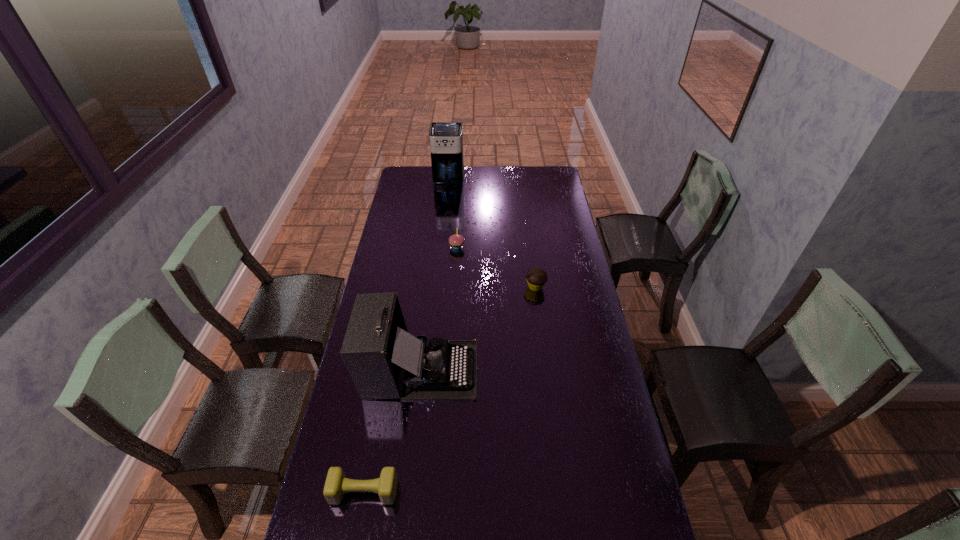
The width and height of the screenshot is (960, 540). Identify the location of coffee maker. (446, 138).

This screenshot has height=540, width=960. I want to click on typewriter, so click(x=384, y=361).

Where is `the fourth nearest object`? This screenshot has height=540, width=960. the fourth nearest object is located at coordinates (456, 240).

This screenshot has height=540, width=960. I want to click on cupcake, so click(x=456, y=240).

In order to click on muffin in this screenshot , I will do `click(536, 277)`.

I want to click on the third farthest object, so click(x=536, y=277).

Locate an element on the screen. Image resolution: width=960 pixels, height=540 pixels. dumbbell is located at coordinates (336, 485).

The image size is (960, 540). Find the location of `vacant space located on the front panel of the coffee maker`. vacant space located on the front panel of the coffee maker is located at coordinates (446, 205).

This screenshot has height=540, width=960. Identify the location of vacant point located inside the open case of the second nearest object. (589, 369).

Where is `vacant space located on the front of the fourth nearest object`? The height and width of the screenshot is (540, 960). vacant space located on the front of the fourth nearest object is located at coordinates tap(452, 318).